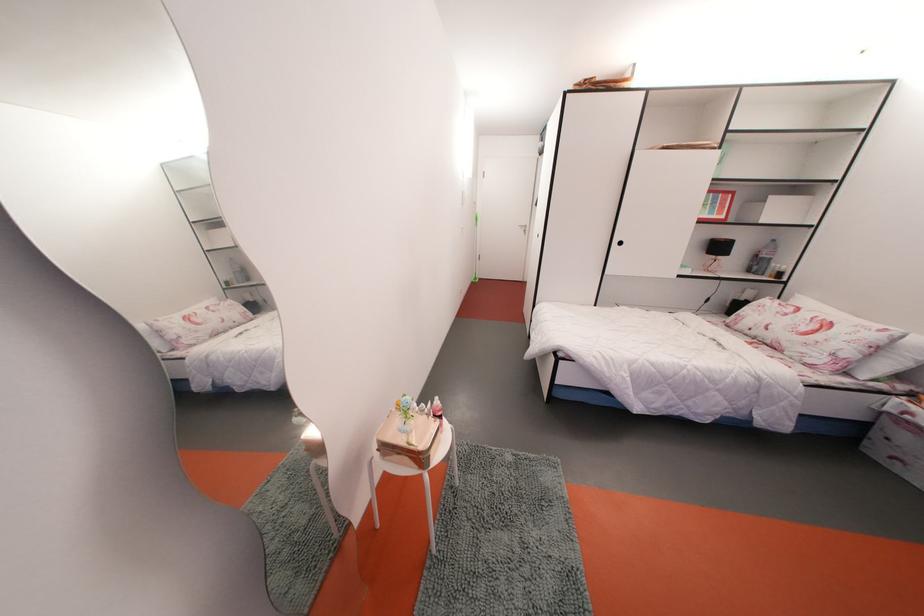
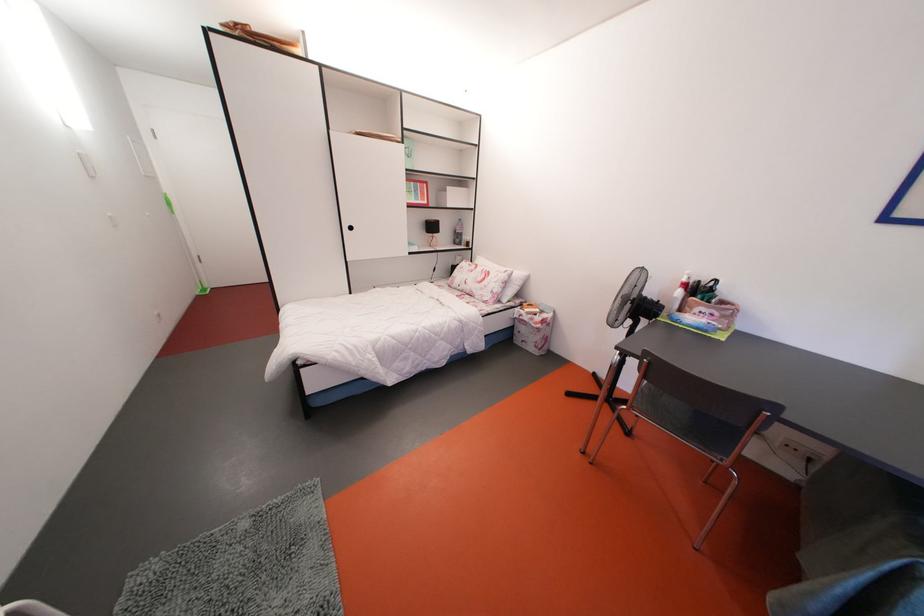
Question: The camera is either moving clockwise (left) or counter-clockwise (right) around the object. The first image is from the beginning of the video and the second image is from the end. Is the camera moving left or right when shooting the video?

Choices:
 (A) Left
 (B) Right

Answer: (A)